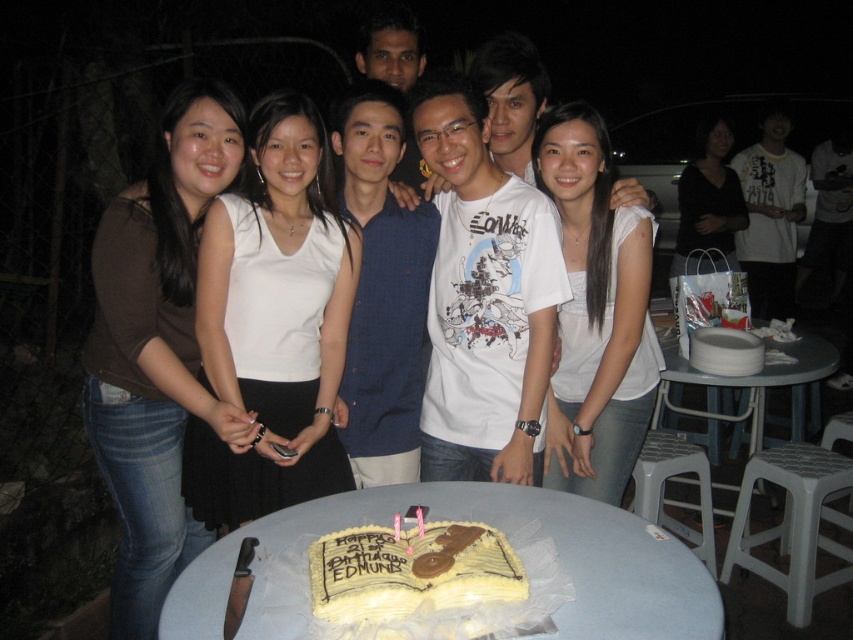
Where is `white matte tank top at center`? white matte tank top at center is located at coordinates (273, 321).

Does white matte tank top at center have a larger size compared to yellow fondant cake at center?

Yes.

This screenshot has width=853, height=640. Find the location of `white matte tank top at center`. white matte tank top at center is located at coordinates (273, 321).

Does white plastic stool at lower right appear under gray plastic stool at lower right?

Yes.

Does white plastic stool at lower right appear on the left side of gray plastic stool at lower right?

No, white plastic stool at lower right is not to the left of gray plastic stool at lower right.

Which is in front, point (822, 515) or point (656, 493)?

Point (656, 493) is more forward.

Image resolution: width=853 pixels, height=640 pixels. Find the location of `white plastic stool at lower right`. white plastic stool at lower right is located at coordinates (793, 522).

Can you confirm if matte black shirt at center is positioned to the left of gray plastic stool at lower right?

In fact, matte black shirt at center is to the right of gray plastic stool at lower right.

Does matte black shirt at center have a greater height compared to gray plastic stool at lower right?

Correct, matte black shirt at center is much taller as gray plastic stool at lower right.

Between point (689, 244) and point (708, 464), which one is positioned behind?

The point (689, 244) is more distant.

Locate an element on the screen. The width and height of the screenshot is (853, 640). matte black shirt at center is located at coordinates (708, 205).